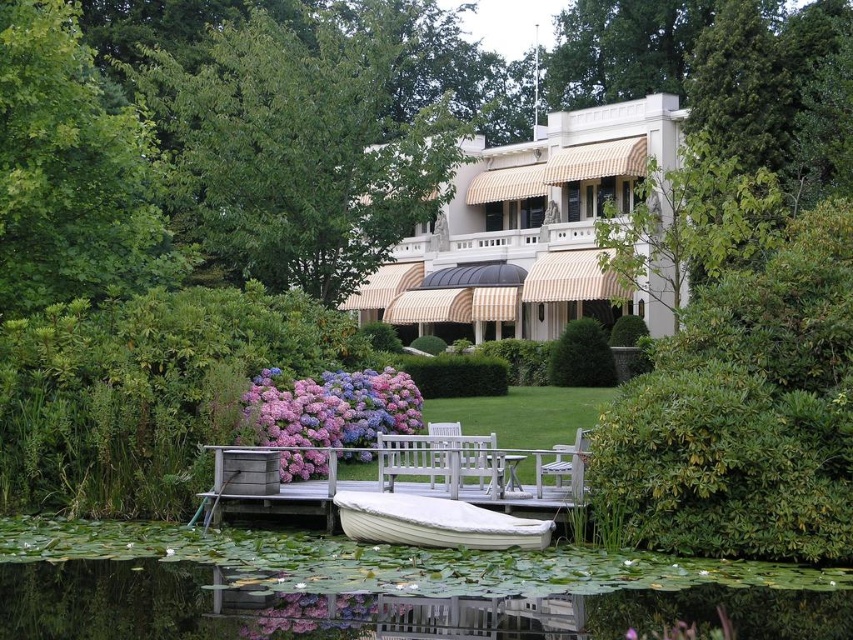
You are sitting on the wooden chair at center and want to look at the green leafy tree at upper left. Can you see it clearly without moving your head?

The wooden chair at center is behind the green leafy tree at upper left, so you cannot see the green leafy tree at upper left clearly without moving your head because the tree is in front of you.

You are planning to host a small gathering on the white wood dock at center and the white wood bench at center. Considering their sizes, which location can accommodate more guests?

The white wood dock at center is bigger than the white wood bench at center, so it can accommodate more guests.